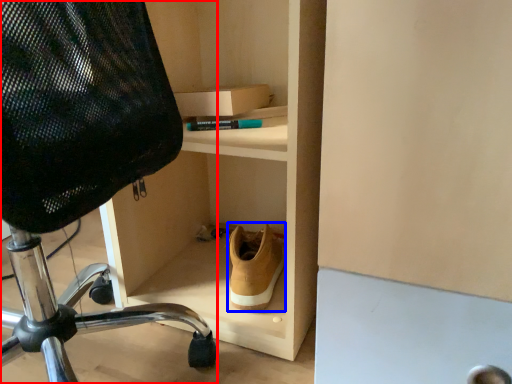
Question: Which point is further to the camera, chair (highlighted by a red box) or shoe (highlighted by a blue box)?

Choices:
 (A) chair
 (B) shoe

Answer: (B)